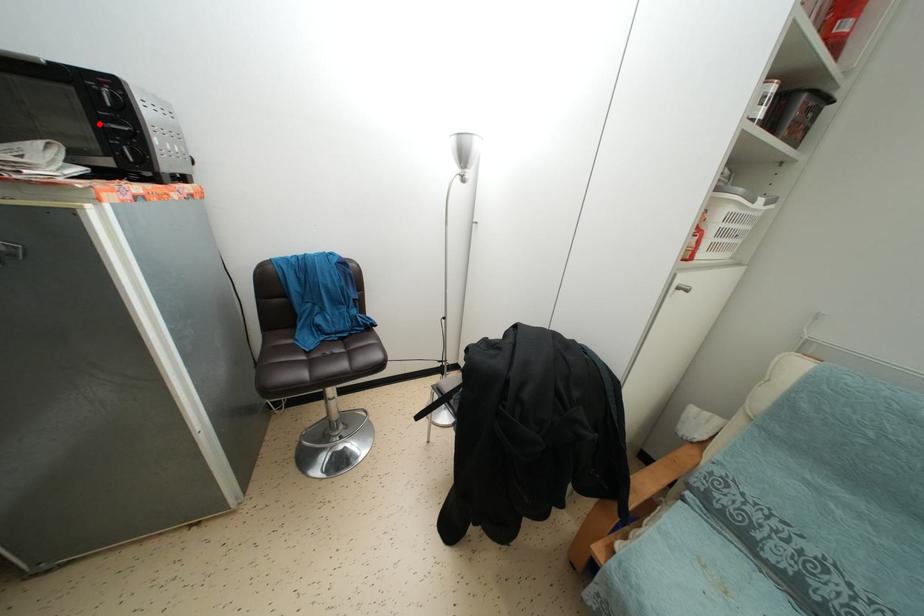
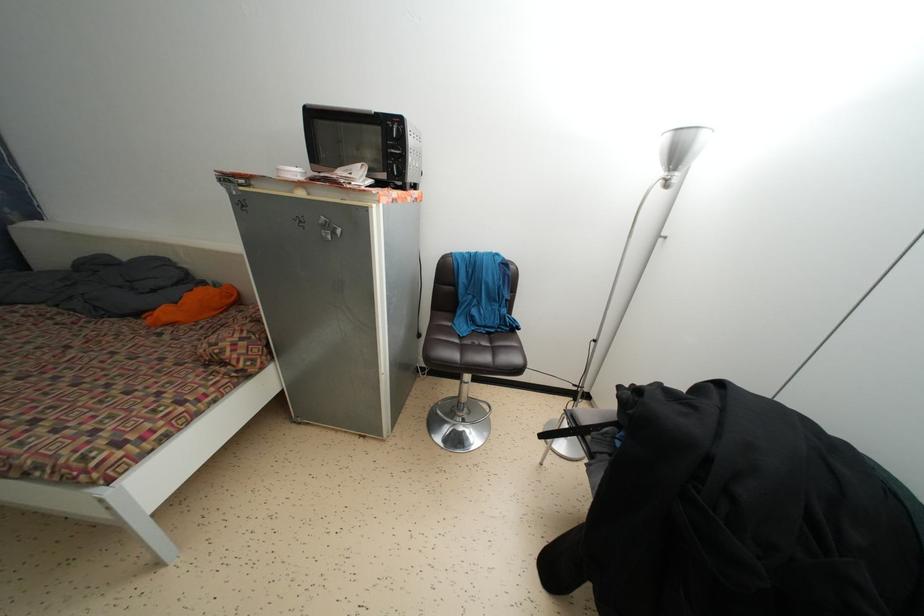
Where in the second image is the point corresponding to the highlighted location from the first image?

(390, 152)